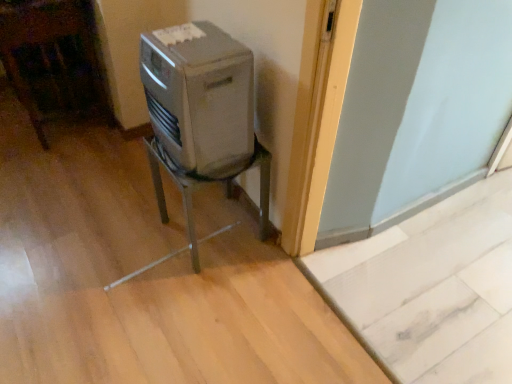
Question: Would you say metallic gray air conditioner at center is to the left or to the right of satin silver appliance at center in the picture?

Choices:
 (A) right
 (B) left

Answer: (A)

Question: Is metallic gray air conditioner at center inside the boundaries of satin silver appliance at center, or outside?

Choices:
 (A) inside
 (B) outside

Answer: (B)

Question: From a real-world perspective, is metallic gray air conditioner at center physically located above or below satin silver appliance at center?

Choices:
 (A) above
 (B) below

Answer: (B)

Question: Considering the positions of satin silver appliance at center and metallic gray air conditioner at center in the image, is satin silver appliance at center taller or shorter than metallic gray air conditioner at center?

Choices:
 (A) tall
 (B) short

Answer: (B)

Question: Based on their sizes in the image, would you say satin silver appliance at center is bigger or smaller than metallic gray air conditioner at center?

Choices:
 (A) small
 (B) big

Answer: (A)

Question: Would you say satin silver appliance at center is inside or outside metallic gray air conditioner at center?

Choices:
 (A) inside
 (B) outside

Answer: (B)

Question: Looking at their shapes, would you say satin silver appliance at center is wider or thinner than metallic gray air conditioner at center?

Choices:
 (A) wide
 (B) thin

Answer: (B)